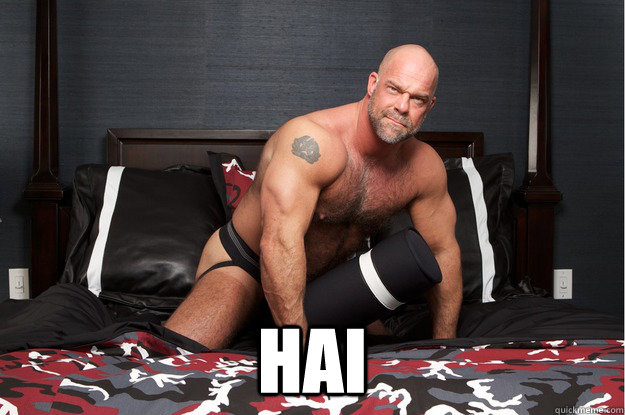
You are a GUI agent. You are given a task and a screenshot of the screen. Output one action in this format:
    pyautogui.click(x=<x>, y=<y>)
    Task: Click on the headboard
    
    Given the screenshot: What is the action you would take?
    pyautogui.click(x=172, y=150)